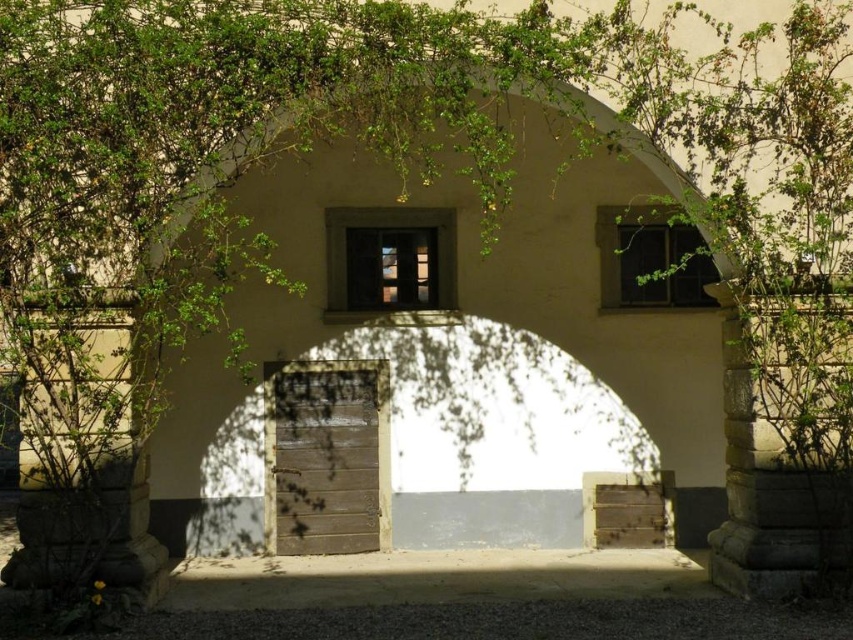
Which is more to the left, matte glass window at center or matte glass window at upper right?

Positioned to the left is matte glass window at center.

Where is `matte glass window at center`? This screenshot has width=853, height=640. matte glass window at center is located at coordinates (387, 262).